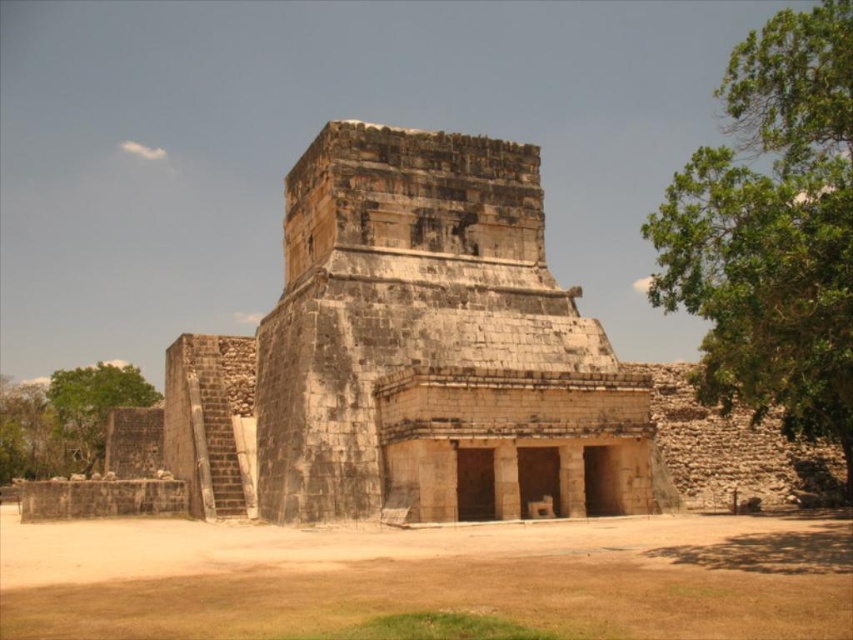
Question: Among these objects, which one is nearest to the camera?

Choices:
 (A) green leafy tree at lower left
 (B) green leafy tree at right
 (C) stone temple at center
 (D) brown sandy dirt at lower center

Answer: (D)

Question: Among these objects, which one is nearest to the camera?

Choices:
 (A) green leafy tree at lower left
 (B) stone temple at center

Answer: (B)

Question: Can you confirm if brown sandy dirt at lower center is bigger than green leafy tree at lower left?

Choices:
 (A) yes
 (B) no

Answer: (B)

Question: Is brown sandy dirt at lower center behind green leafy tree at right?

Choices:
 (A) no
 (B) yes

Answer: (A)

Question: Which is farther from the green leafy tree at right?

Choices:
 (A) green leafy tree at lower left
 (B) stone temple at center

Answer: (A)

Question: Can you confirm if brown sandy dirt at lower center is bigger than green leafy tree at right?

Choices:
 (A) yes
 (B) no

Answer: (B)